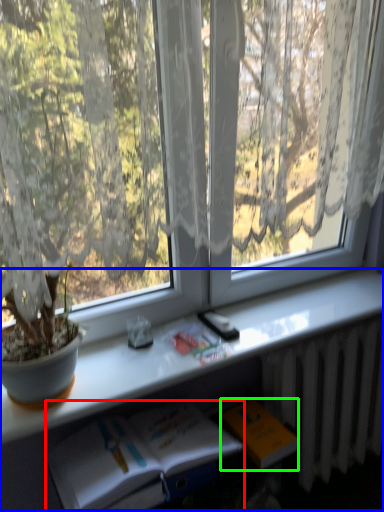
Question: Which is nearer to the book (highlighted by a red box)? computer desk (highlighted by a blue box) or paperback book (highlighted by a green box).

Choices:
 (A) computer desk
 (B) paperback book

Answer: (A)